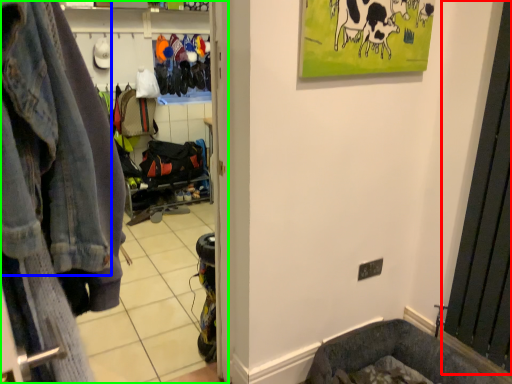
Question: Based on their relative distances, which object is farther from screen door (highlighted by a red box)? Choose from denim jacket (highlighted by a blue box) and clothing store (highlighted by a green box).

Choices:
 (A) denim jacket
 (B) clothing store

Answer: (A)